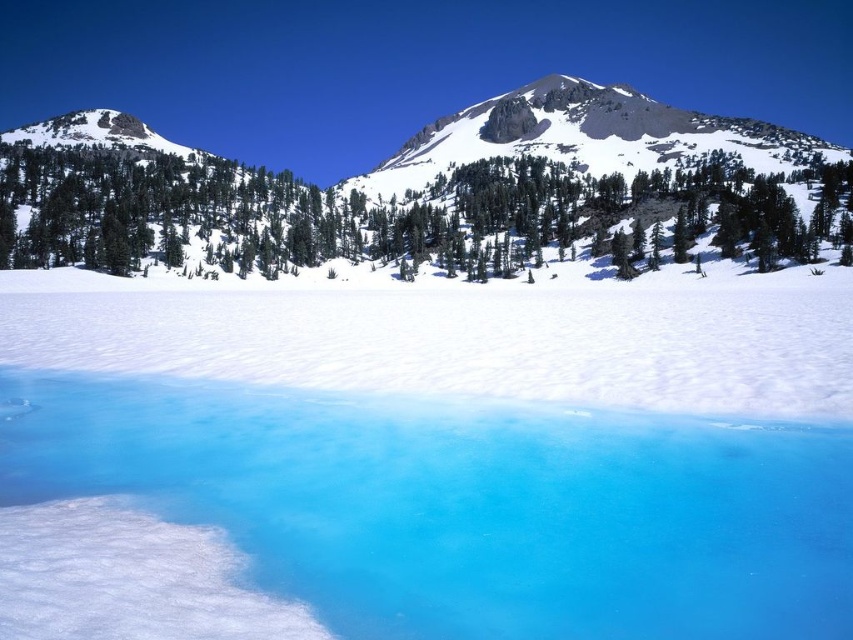
Which is below, translucent ice water at center or green matte tree at center?

translucent ice water at center

Is translucent ice water at center taller than green matte tree at center?

No, translucent ice water at center is not taller than green matte tree at center.

Is point (837, 621) positioned in front of point (151, 161)?

Yes.

The image size is (853, 640). In order to click on translucent ice water at center in this screenshot , I will do `click(467, 506)`.